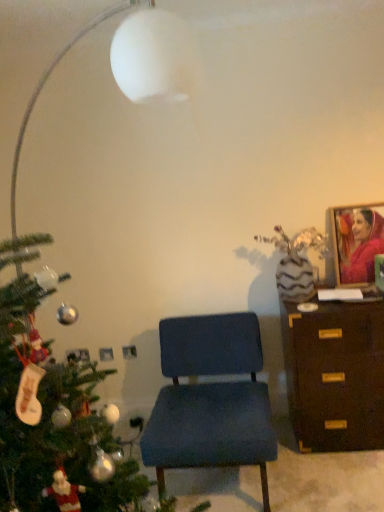
Question: Is blue fabric chair at center in front of or behind brown wooden chest of drawers at right in the image?

Choices:
 (A) front
 (B) behind

Answer: (A)

Question: Is blue fabric chair at center spatially inside brown wooden chest of drawers at right, or outside of it?

Choices:
 (A) outside
 (B) inside

Answer: (A)

Question: Which object is positioned farthest from the blue fabric chair at center?

Choices:
 (A) brown wooden chest of drawers at right
 (B) matte pink fabric portrait at upper right

Answer: (B)

Question: Which object is positioned closest to the blue fabric chair at center?

Choices:
 (A) matte pink fabric portrait at upper right
 (B) brown wooden chest of drawers at right

Answer: (B)